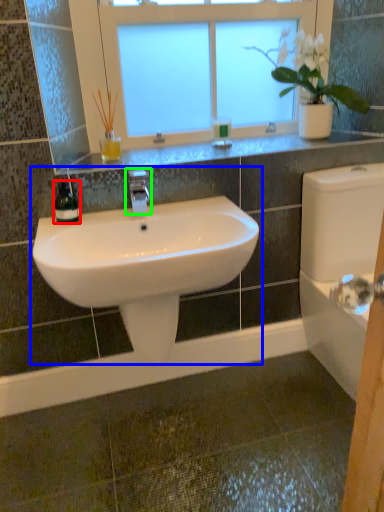
Question: Which object is positioned closest to soap dispenser (highlighted by a red box)? Select from sink (highlighted by a blue box) and tap (highlighted by a green box).

Choices:
 (A) sink
 (B) tap

Answer: (B)